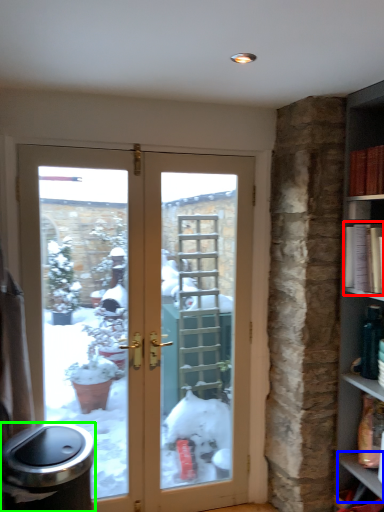
Question: Estimate the real-world distances between objects in this image. Which object is farther from book (highlighted by a red box), window sill (highlighted by a blue box) or garbage (highlighted by a green box)?

Choices:
 (A) window sill
 (B) garbage

Answer: (B)